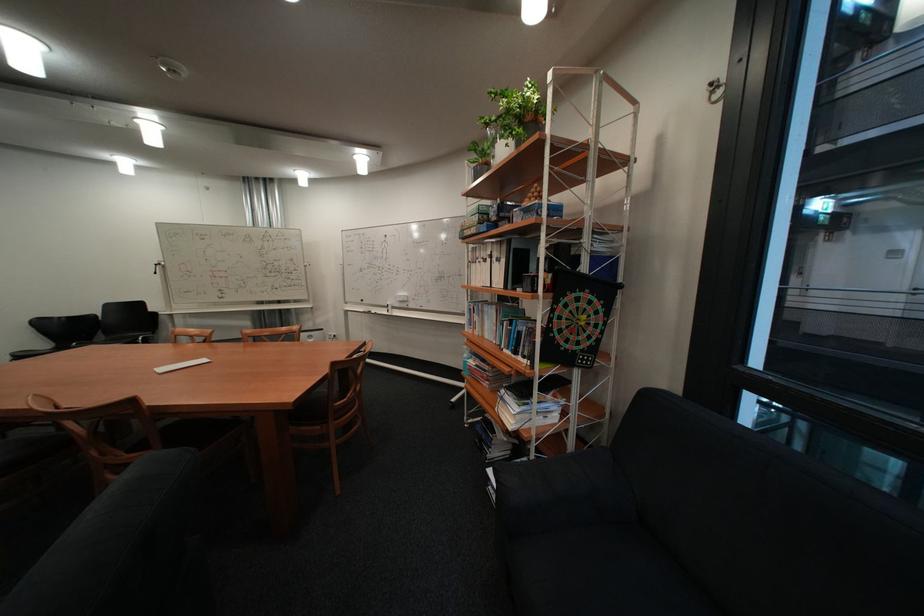
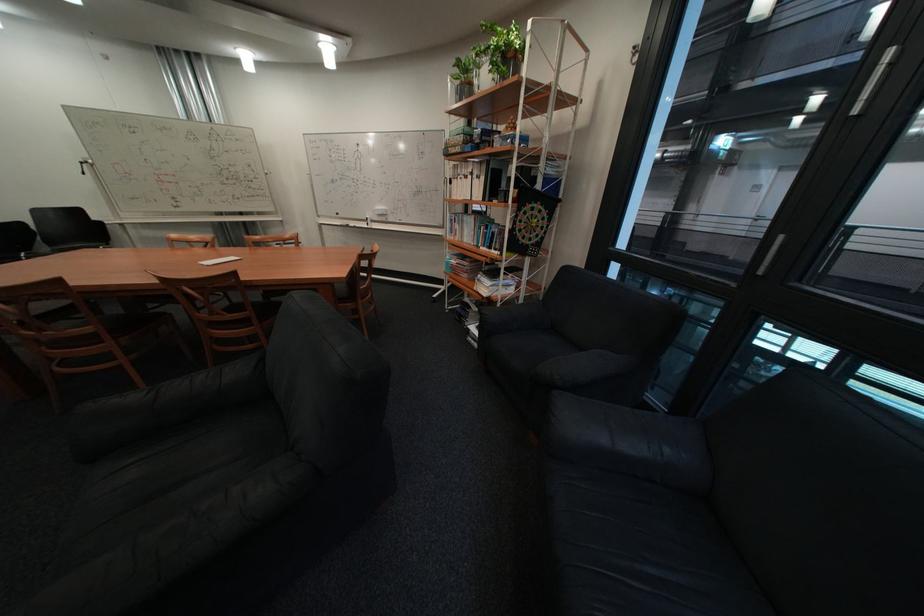
In a continuous first-person perspective shot, in which direction is the camera moving?

The cameraman walked toward left, backward.